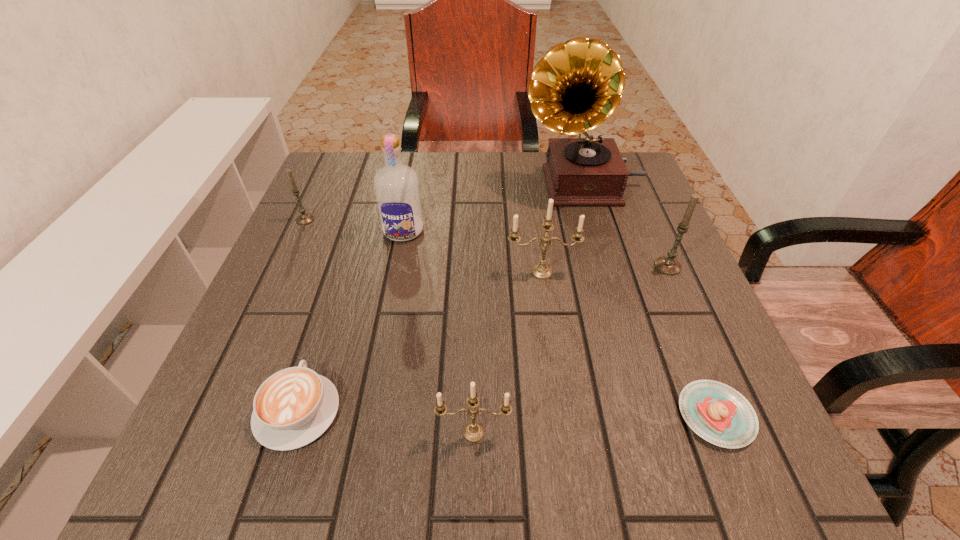
The image size is (960, 540). Identify the location of vacant space situated on the left of the bigger metallic candle. (409, 272).

You are a GUI agent. You are given a task and a screenshot of the screen. Output one action in this format:
    pyautogui.click(x=<x>, y=<y>)
    Task: Click on the vacant area situated on the right of the leftmost candle
    The width and height of the screenshot is (960, 540).
    Given the screenshot: What is the action you would take?
    pyautogui.click(x=387, y=220)

Locate an element on the screen. vacant space located on the back of the left metallic candle is located at coordinates (475, 316).

This screenshot has width=960, height=540. What are the coordinates of `vacant space located 0.070m on the side of the second object from left to right with the handle` in the screenshot? It's located at (321, 339).

In order to click on vacant space located on the side of the second object from left to right with the handle in this screenshot , I will do `click(345, 262)`.

You are a GUI agent. You are given a task and a screenshot of the screen. Output one action in this format:
    pyautogui.click(x=<x>, y=<y>)
    Task: Click on the blank space located 0.280m on the side of the second object from left to right with the handle
    This screenshot has width=960, height=540.
    Given the screenshot: What is the action you would take?
    [x=346, y=259]

Locate an element on the screen. Image resolution: width=960 pixels, height=540 pixels. free point located 0.220m on the back of the pastry is located at coordinates (663, 286).

At what (x,y) coordinates should I click in order to perform the action: click on object that is at the far edge. Please return your answer as a coordinate pair (x, y). Looking at the image, I should click on (577, 85).

This screenshot has width=960, height=540. I want to click on candle at the near edge, so click(473, 432).

You are a GUI agent. You are given a task and a screenshot of the screen. Output one action in this format:
    pyautogui.click(x=<x>, y=<y>)
    Task: Click on the cappuccino located in the near edge section of the desktop
    
    Given the screenshot: What is the action you would take?
    pyautogui.click(x=293, y=407)